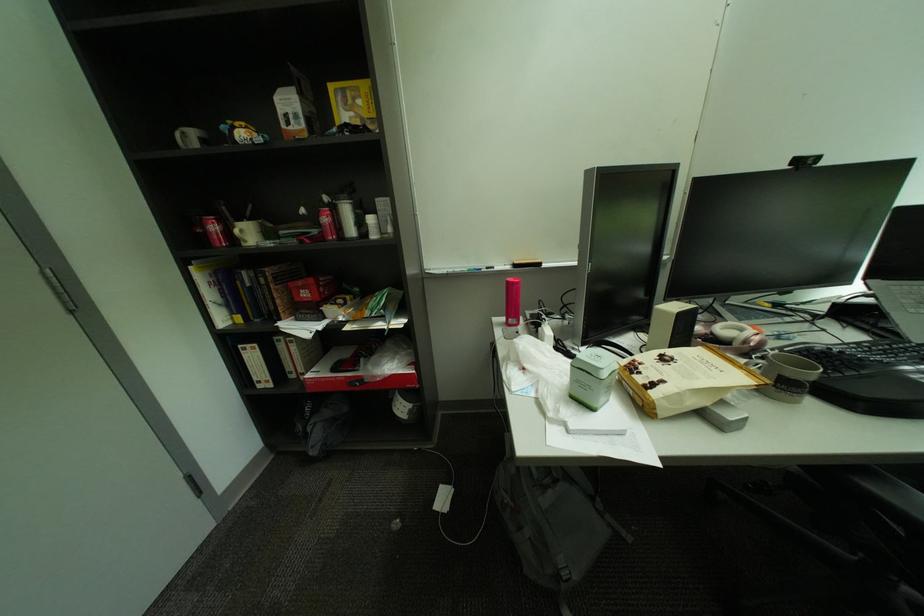
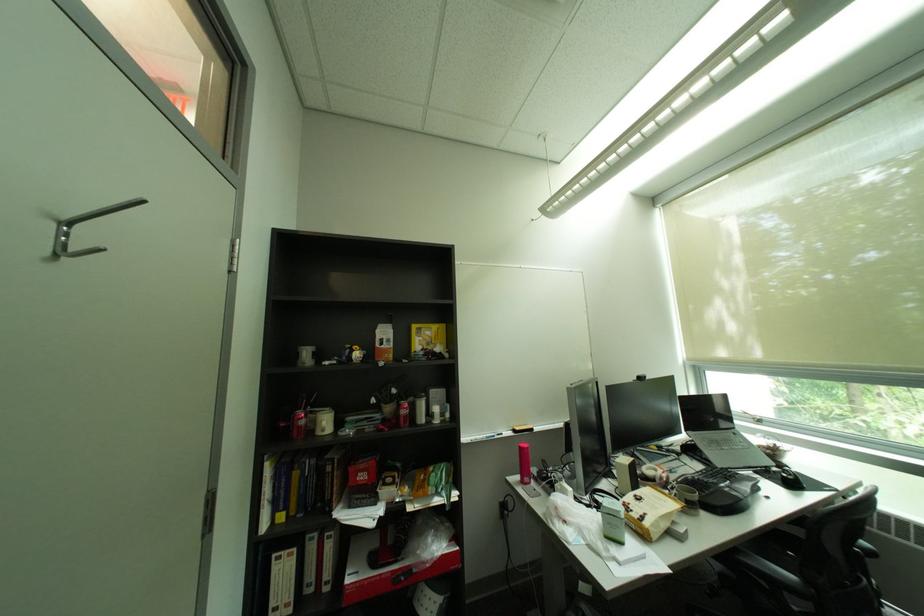
Find the pixel in the second image that matches the point at 791,377 in the first image.

(697, 500)